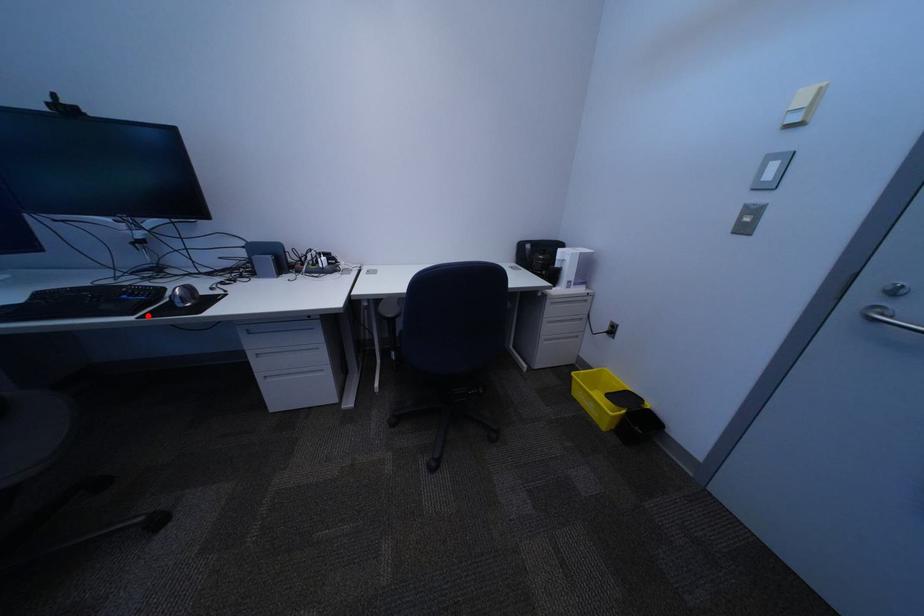
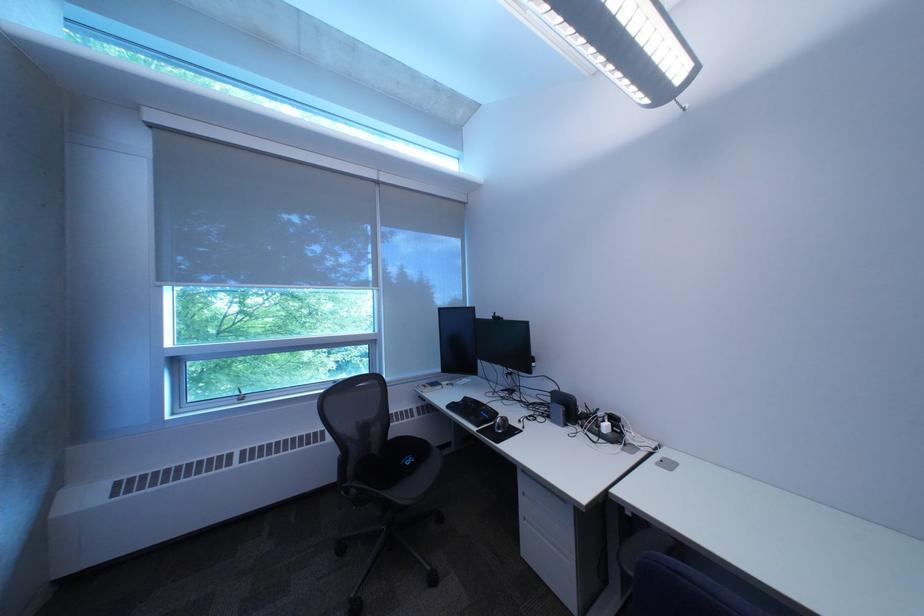
Question: I am providing you with two images of the same scene from different viewpoints. A red point is marked on the first image. At the location where the point appears in image 1, is it still visible in image 2?

Choices:
 (A) Yes
 (B) No

Answer: (A)